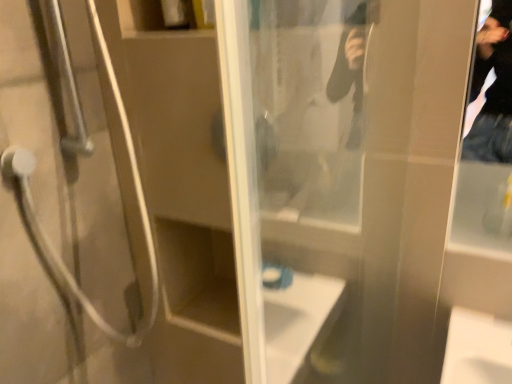
Question: From the image's perspective, would you say transparent glass screen door at center is positioned over metallic silver shower door at left?

Choices:
 (A) no
 (B) yes

Answer: (A)

Question: Is transparent glass screen door at center not inside metallic silver shower door at left?

Choices:
 (A) no
 (B) yes

Answer: (B)

Question: Does transparent glass screen door at center have a lesser height compared to metallic silver shower door at left?

Choices:
 (A) yes
 (B) no

Answer: (B)

Question: From a real-world perspective, is transparent glass screen door at center over metallic silver shower door at left?

Choices:
 (A) no
 (B) yes

Answer: (A)

Question: Are transparent glass screen door at center and metallic silver shower door at left located far from each other?

Choices:
 (A) yes
 (B) no

Answer: (B)

Question: From a real-world perspective, is transparent glass screen door at center below metallic silver shower door at left?

Choices:
 (A) yes
 (B) no

Answer: (A)

Question: Can you confirm if metallic silver shower door at left is bigger than transparent glass screen door at center?

Choices:
 (A) no
 (B) yes

Answer: (B)

Question: From the image's perspective, is metallic silver shower door at left located beneath transparent glass screen door at center?

Choices:
 (A) no
 (B) yes

Answer: (A)

Question: Is metallic silver shower door at left not close to transparent glass screen door at center?

Choices:
 (A) yes
 (B) no

Answer: (B)

Question: Is metallic silver shower door at left at the right side of transparent glass screen door at center?

Choices:
 (A) yes
 (B) no

Answer: (B)

Question: Considering the relative sizes of metallic silver shower door at left and transparent glass screen door at center in the image provided, is metallic silver shower door at left wider than transparent glass screen door at center?

Choices:
 (A) no
 (B) yes

Answer: (B)

Question: Is metallic silver shower door at left surrounding transparent glass screen door at center?

Choices:
 (A) no
 (B) yes

Answer: (A)

Question: Relative to metallic silver shower door at left, is transparent glass screen door at center in front or behind?

Choices:
 (A) behind
 (B) front

Answer: (B)